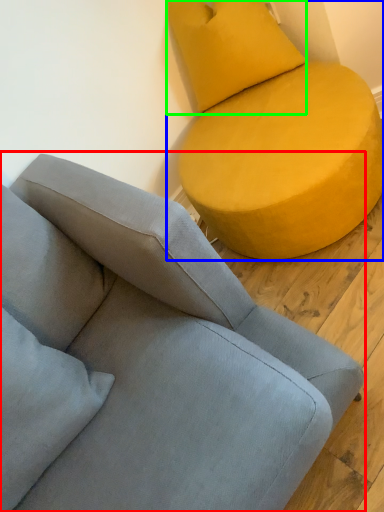
Question: Which object is positioned closest to studio couch (highlighted by a red box)? Select from studio couch (highlighted by a blue box) and pillow (highlighted by a green box).

Choices:
 (A) studio couch
 (B) pillow

Answer: (A)